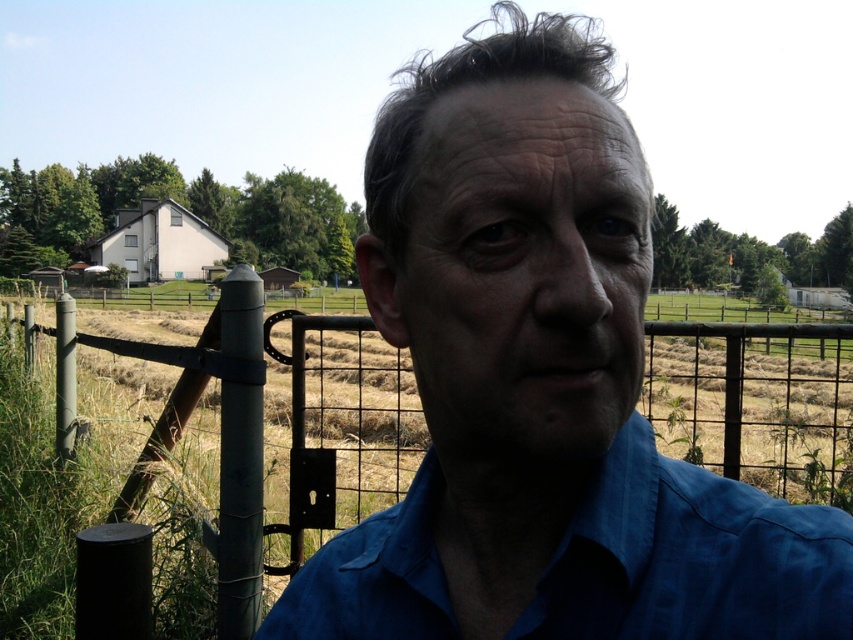
You are a photographer standing at the position of the blue fabric shirt at center in the scene. You want to take a photo of the metal wire fence at center without any obstructions. Given that your camera has a maximum zoom range that can capture objects up to 10 meters away, will you be able to take the photo clearly?

The distance between the blue fabric shirt at center and the metal wire fence at center is 11.11 meters, which exceeds the camera maximum zoom range of 10 meters. Therefore, you will not be able to take a clear photo of the metal wire fence at center without obstructions.

You are a photographer trying to capture the blue fabric shirt at center and the metal wire fence at center in the same frame. Based on their sizes, which object would appear smaller in the photo?

The blue fabric shirt at center would appear smaller in the photo because it is thinner than the metal wire fence at center.